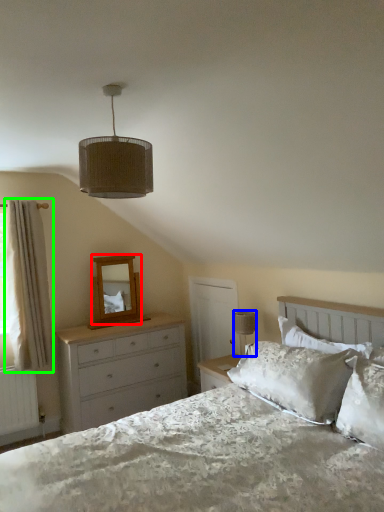
Question: Estimate the real-world distances between objects in this image. Which object is closer to mirror (highlighted by a red box), table lamp (highlighted by a blue box) or curtain (highlighted by a green box)?

Choices:
 (A) table lamp
 (B) curtain

Answer: (B)